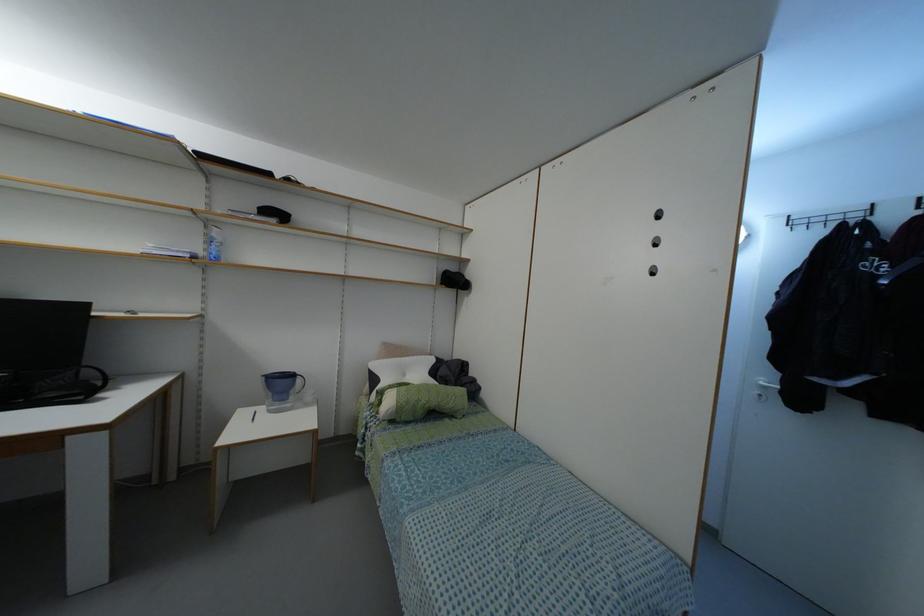
The width and height of the screenshot is (924, 616). What do you see at coordinates (766, 384) in the screenshot? I see `the silver door handle` at bounding box center [766, 384].